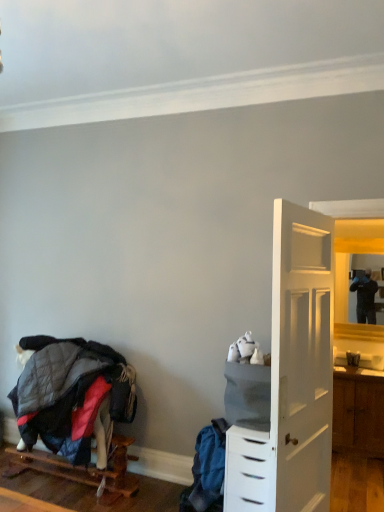
Question: Is matte wooden mirror at right wider or thinner than wooden pallet at lower left?

Choices:
 (A) wide
 (B) thin

Answer: (B)

Question: Looking at the image, does matte wooden mirror at right seem bigger or smaller compared to wooden pallet at lower left?

Choices:
 (A) small
 (B) big

Answer: (A)

Question: Based on their relative distances, which object is nearer to the wooden pallet at lower left?

Choices:
 (A) matte wooden mirror at right
 (B) quilted fabric bunk bed at lower left
 (C) white plastic chest of drawers at right

Answer: (B)

Question: Considering the real-world distances, which object is farthest from the wooden pallet at lower left?

Choices:
 (A) matte wooden mirror at right
 (B) white plastic chest of drawers at right
 (C) quilted fabric bunk bed at lower left

Answer: (A)